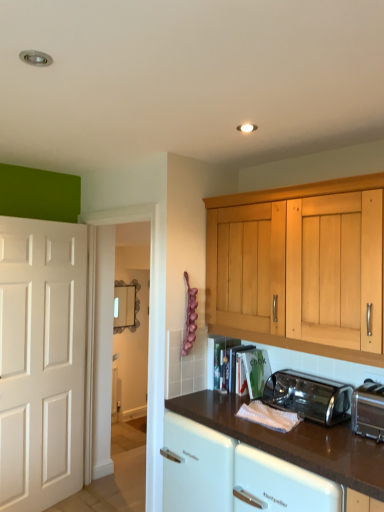
Question: Looking at their shapes, would you say polished stainless steel toaster at lower center, the 1th toaster when ordered from back to front, is wider or thinner than silver metallic toaster at lower right, marked as the first toaster in a front-to-back arrangement?

Choices:
 (A) wide
 (B) thin

Answer: (A)

Question: Considering the positions of point (337, 386) and point (360, 423), is point (337, 386) closer or farther from the camera than point (360, 423)?

Choices:
 (A) closer
 (B) farther

Answer: (B)

Question: Estimate the real-world distances between objects in this image. Which object is farther from the polished stainless steel toaster at lower center, the 1th toaster when ordered from back to front?

Choices:
 (A) brown glossy countertop at lower center
 (B) silver metallic toaster at lower right, arranged as the 2th toaster when viewed from the back

Answer: (A)

Question: Which is farther from the brown glossy countertop at lower center?

Choices:
 (A) polished stainless steel toaster at lower center, the 1th toaster when ordered from back to front
 (B) silver metallic toaster at lower right, arranged as the 2th toaster when viewed from the back

Answer: (B)